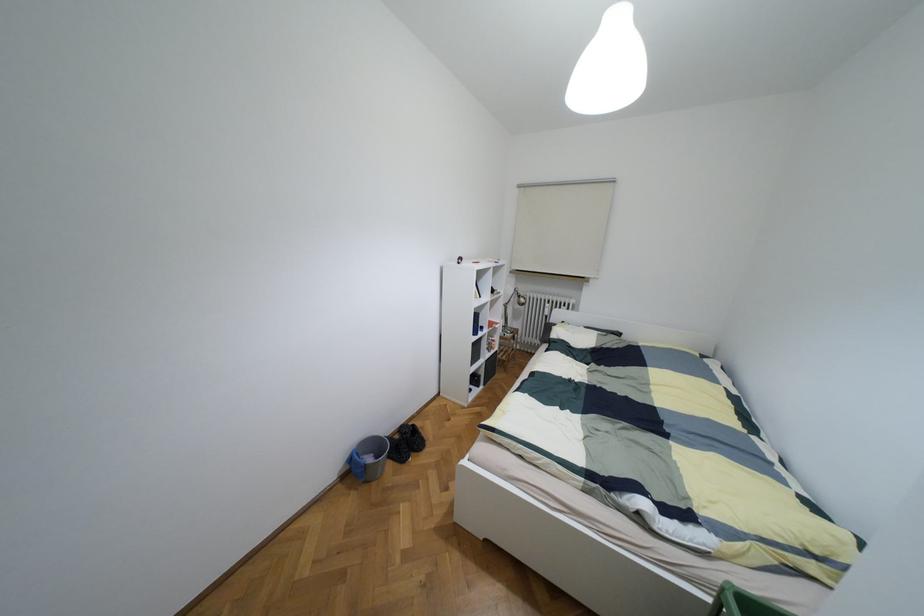
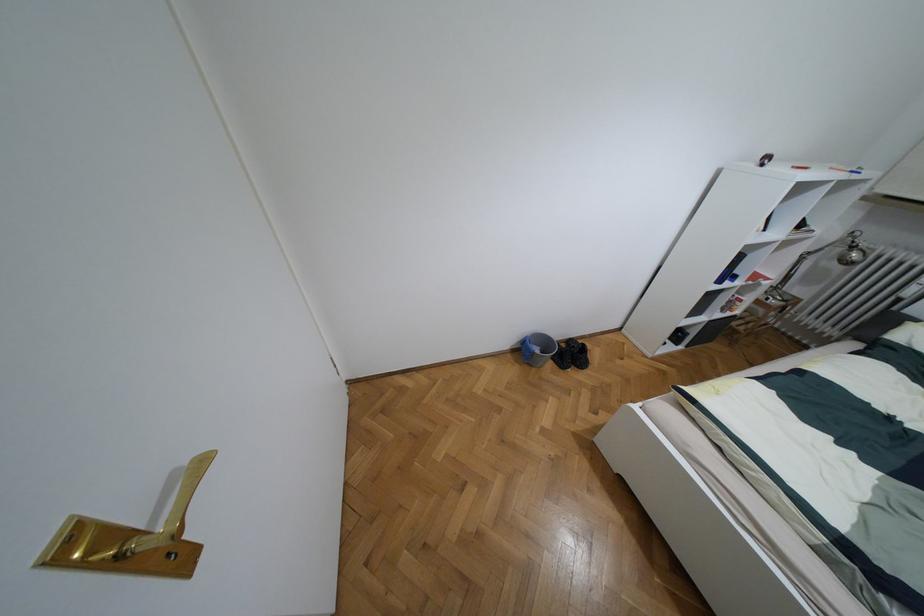
Where in the second image is the point corresponding to (x=395, y=436) from the first image?

(563, 345)